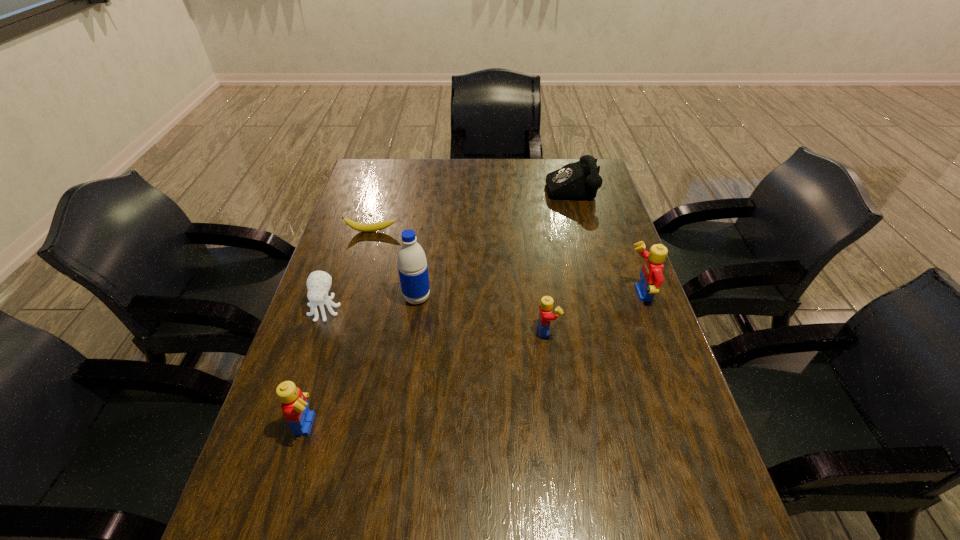
If equal spacing is desired by inserting an extra Lego among them, please point out a free spot for this new Lego. Please provide its 2D coordinates. Your answer should be formatted as a tuple, i.e. [(x, y)], where the tuple contains the x and y coordinates of a point satisfying the conditions above.

[(440, 373)]